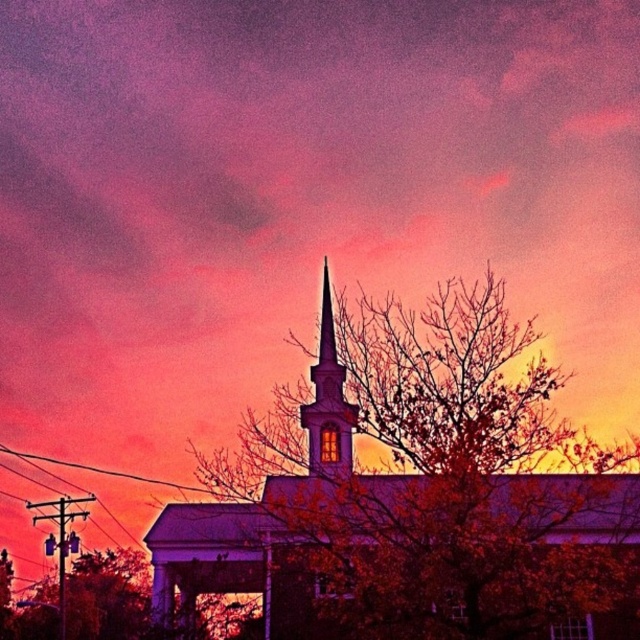
You are an architect analyzing the proportions of the church and its steeple in the sunset scene. Based on the image, which structure is wider when comparing the white stucco church at center and the smooth white steeple at center?

The white stucco church at center is wider than the smooth white steeple at center according to the description.

You are an architect analyzing the church structure. Based on the image, which object is positioned higher in the scene between the white stucco church at center and the smooth white steeple at center?

The smooth white steeple at center is positioned higher than the white stucco church at center in the scene.

You are an architect analyzing the proportions of the church and its steeple in the image. Which object, the white stucco church at center or the smooth white steeple at center, has a greater overall size?

The white stucco church at center is larger in size than the smooth white steeple at center, so the white stucco church at center has a greater overall size.